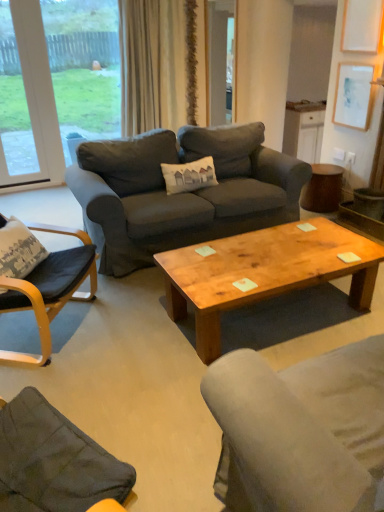
Where is `white plastic window at upper left, acting as the 1th window starting from the left`? white plastic window at upper left, acting as the 1th window starting from the left is located at coordinates (18, 106).

Describe the element at coordinates (263, 272) in the screenshot. I see `wooden coffee table at center` at that location.

Measure the distance between point (115, 174) and camera.

Point (115, 174) and camera are 3.17 meters apart from each other.

The image size is (384, 512). What are the coordinates of `brown wooden side table at right` in the screenshot? It's located at (323, 189).

I want to click on beige fabric curtain at upper center, so click(152, 65).

Identify the location of white plastic window at upper left, acting as the 1th window starting from the left. (18, 106).

Would you say black leather chair at left is part of white plastic window at upper left, acting as the 1th window starting from the left,'s contents?

Definitely not — black leather chair at left is not inside white plastic window at upper left, acting as the 1th window starting from the left.

What's the angular difference between white plastic window at upper left, acting as the 1th window starting from the left, and black leather chair at left's facing directions?

56.1 degrees.

Where is `the 1st window above the black leather chair at left (from a real-world perspective)`? Image resolution: width=384 pixels, height=512 pixels. the 1st window above the black leather chair at left (from a real-world perspective) is located at coordinates (18, 106).

Which is nearer, (x=31, y=93) or (x=49, y=297)?

Point (x=31, y=93) is farther from the camera than point (x=49, y=297).

From the image's perspective, relative to white paper at upper right, is transparent glass window at upper left, which is the 1th window in right-to-left order, above or below?

From the image's perspective, transparent glass window at upper left, which is the 1th window in right-to-left order, appears above white paper at upper right.

How distant is transparent glass window at upper left, which is the 1th window in right-to-left order, from white paper at upper right?

A distance of 3.16 meters exists between transparent glass window at upper left, which is the 1th window in right-to-left order, and white paper at upper right.

Can you confirm if transparent glass window at upper left, arranged as the second window when viewed from the left, is bigger than white paper at upper right?

Yes, transparent glass window at upper left, arranged as the second window when viewed from the left, is bigger than white paper at upper right.

Which is behind, white paper at upper right or transparent glass window at upper left, arranged as the second window when viewed from the left?

transparent glass window at upper left, arranged as the second window when viewed from the left.

Looking at their sizes, would you say white paper at upper right is wider or thinner than transparent glass window at upper left, arranged as the second window when viewed from the left?

white paper at upper right is thinner than transparent glass window at upper left, arranged as the second window when viewed from the left.

Is point (355, 92) in front of point (20, 121)?

Yes, point (355, 92) is closer to viewer.

Where is `picture frame to the right of transparent glass window at upper left, which is the 1th window in right-to-left order`? This screenshot has width=384, height=512. picture frame to the right of transparent glass window at upper left, which is the 1th window in right-to-left order is located at coordinates (353, 95).

From their relative heights in the image, would you say white paper at upper right is taller or shorter than black leather chair at left?

Clearly, white paper at upper right is shorter compared to black leather chair at left.

From the image's perspective, who appears lower, white paper at upper right or black leather chair at left?

black leather chair at left appears lower in the image.

From a real-world perspective, is white paper at upper right physically below black leather chair at left?

No.

Image resolution: width=384 pixels, height=512 pixels. Identify the location of picture frame that is behind the black leather chair at left. (353, 95).

Which is more to the right, black leather chair at left or wooden coffee table at center?

Positioned to the right is wooden coffee table at center.

Does black leather chair at left come in front of wooden coffee table at center?

Yes, black leather chair at left is closer to the viewer.

From a real-world perspective, which is physically above, black leather chair at left or wooden coffee table at center?

From a 3D spatial view, black leather chair at left is above.

Are dark gray fabric couch at center and transparent glass window at upper left, which is the 1th window in right-to-left order, making contact?

No, dark gray fabric couch at center is not in contact with transparent glass window at upper left, which is the 1th window in right-to-left order.

Does point (150, 133) come behind point (109, 67)?

No, it is in front of (109, 67).

Locate an element on the screen. The width and height of the screenshot is (384, 512). studio couch on the right side of transparent glass window at upper left, arranged as the second window when viewed from the left is located at coordinates (180, 193).

Considering the sizes of objects dark gray fabric couch at center and transparent glass window at upper left, arranged as the second window when viewed from the left, in the image provided, who is taller, dark gray fabric couch at center or transparent glass window at upper left, arranged as the second window when viewed from the left,?

With more height is transparent glass window at upper left, arranged as the second window when viewed from the left.

Considering the relative sizes of white paper at upper right and beige fabric curtain at upper center in the image provided, is white paper at upper right wider than beige fabric curtain at upper center?

No.

This screenshot has height=512, width=384. What are the coordinates of `picture frame to the right of beige fabric curtain at upper center` in the screenshot? It's located at (353, 95).

Is white paper at upper right oriented towards beige fabric curtain at upper center?

No, white paper at upper right is not aimed at beige fabric curtain at upper center.

From the picture: Considering the relative positions of white paper at upper right and beige fabric curtain at upper center in the image provided, is white paper at upper right in front of beige fabric curtain at upper center?

Yes, white paper at upper right is closer to the viewer.

I want to click on the 1st window above when counting from the black leather chair at left (from the image's perspective), so click(18, 106).

This screenshot has width=384, height=512. What are the coordinates of `the 1st window to the left when counting from the white paper at upper right` in the screenshot? It's located at (55, 84).

Which object lies nearer to the anchor point dark gray fabric couch at center, black leather chair at left or beige fabric curtain at upper center?

black leather chair at left is positioned closer to the anchor dark gray fabric couch at center.

Which object lies further to the anchor point white paper at upper right, white plastic window at upper left, acting as the 1th window starting from the left, or transparent glass window at upper left, which is the 1th window in right-to-left order?

transparent glass window at upper left, which is the 1th window in right-to-left order, lies further to white paper at upper right than the other object.

Considering their positions, is dark gray fabric couch at center positioned closer to transparent glass window at upper left, which is the 1th window in right-to-left order, than white plastic window at upper left, marked as the 2th window in a right-to-left arrangement?

Based on the image, white plastic window at upper left, marked as the 2th window in a right-to-left arrangement, appears to be nearer to transparent glass window at upper left, which is the 1th window in right-to-left order.

From the image, which object appears to be nearer to beige fabric curtain at upper center, dark gray fabric couch at center or white paper at upper right?

dark gray fabric couch at center.

Considering their positions, is wooden coffee table at center positioned further to dark gray fabric couch at center than black leather chair at left?

black leather chair at left is positioned further to the anchor dark gray fabric couch at center.

Based on their spatial positions, is brown wooden side table at right or dark gray fabric couch at center closer to white plastic window at upper left, acting as the 1th window starting from the left?

The object closer to white plastic window at upper left, acting as the 1th window starting from the left, is dark gray fabric couch at center.

Based on their spatial positions, is black leather chair at left or beige fabric curtain at upper center closer to white paper at upper right?

The object closer to white paper at upper right is beige fabric curtain at upper center.

Based on their spatial positions, is white plastic window at upper left, acting as the 1th window starting from the left, or beige fabric curtain at upper center closer to wooden coffee table at center?

The object closer to wooden coffee table at center is beige fabric curtain at upper center.

Find the location of `curtain between white plastic window at upper left, marked as the 2th window in a right-to-left arrangement, and brown wooden side table at right`. curtain between white plastic window at upper left, marked as the 2th window in a right-to-left arrangement, and brown wooden side table at right is located at coordinates (152, 65).

Identify the location of chair between white plastic window at upper left, marked as the 2th window in a right-to-left arrangement, and wooden coffee table at center from left to right. (50, 289).

Identify the location of coffee table positioned between black leather chair at left and beige fabric curtain at upper center from near to far. (263, 272).

Identify the location of side table between white plastic window at upper left, marked as the 2th window in a right-to-left arrangement, and white paper at upper right. This screenshot has width=384, height=512. (323, 189).